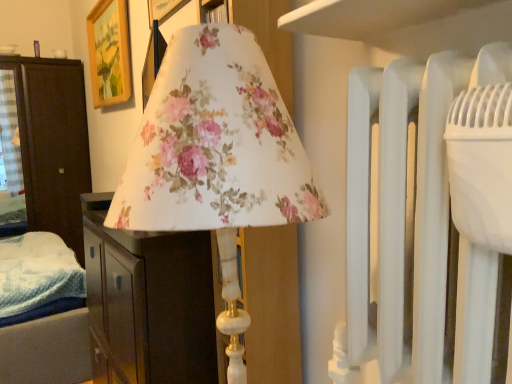
Question: Can you confirm if floral fabric lampshade at center, the 1th furniture in the front-to-back sequence, is thinner than wooden picture frame at upper left?

Choices:
 (A) no
 (B) yes

Answer: (A)

Question: From the image's perspective, does floral fabric lampshade at center, placed as the second furniture when sorted from left to right, appear lower than wooden picture frame at upper left?

Choices:
 (A) yes
 (B) no

Answer: (A)

Question: Does floral fabric lampshade at center, the 1th furniture in the front-to-back sequence, appear on the right side of wooden picture frame at upper left?

Choices:
 (A) no
 (B) yes

Answer: (B)

Question: From a real-world perspective, does floral fabric lampshade at center, positioned as the 1th furniture in right-to-left order, stand above wooden picture frame at upper left?

Choices:
 (A) no
 (B) yes

Answer: (A)

Question: Would you say floral fabric lampshade at center, the 1th furniture in the front-to-back sequence, contains wooden picture frame at upper left?

Choices:
 (A) no
 (B) yes

Answer: (A)

Question: Is floral fabric lampshade at center, the 1th furniture in the front-to-back sequence, completely or partially inside dark wood wardrobe at left, the first furniture positioned from the left?

Choices:
 (A) no
 (B) yes

Answer: (A)

Question: Is dark wood wardrobe at left, the first furniture positioned from the left, taller than floral fabric lampshade at center, which is the second furniture from back to front?

Choices:
 (A) yes
 (B) no

Answer: (A)

Question: Is the position of dark wood wardrobe at left, the first furniture positioned from the left, less distant than that of floral fabric lampshade at center, which is the second furniture from back to front?

Choices:
 (A) no
 (B) yes

Answer: (A)

Question: Is dark wood wardrobe at left, the first furniture positioned from the left, positioned with its back to floral fabric lampshade at center, the 1th furniture in the front-to-back sequence?

Choices:
 (A) no
 (B) yes

Answer: (A)

Question: From the image's perspective, is dark wood wardrobe at left, arranged as the second furniture when viewed from the front, below floral fabric lampshade at center, the 1th furniture in the front-to-back sequence?

Choices:
 (A) yes
 (B) no

Answer: (B)

Question: Is dark wood wardrobe at left, arranged as the second furniture when viewed from the front, at the left side of floral fabric lampshade at center, the 1th furniture in the front-to-back sequence?

Choices:
 (A) yes
 (B) no

Answer: (A)

Question: Is dark wood wardrobe at left, arranged as the second furniture when viewed from the front, further to the viewer compared to wooden picture frame at upper left?

Choices:
 (A) yes
 (B) no

Answer: (A)